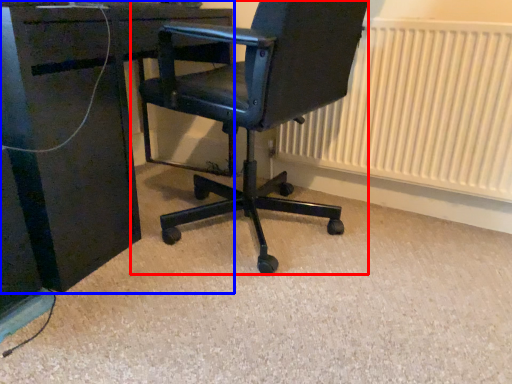
Question: Which point is closer to the camera, chair (highlighted by a red box) or desk (highlighted by a blue box)?

Choices:
 (A) chair
 (B) desk

Answer: (A)